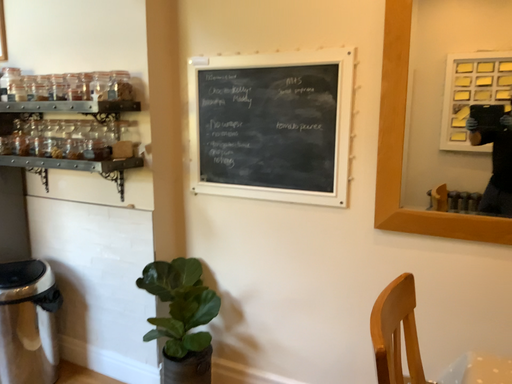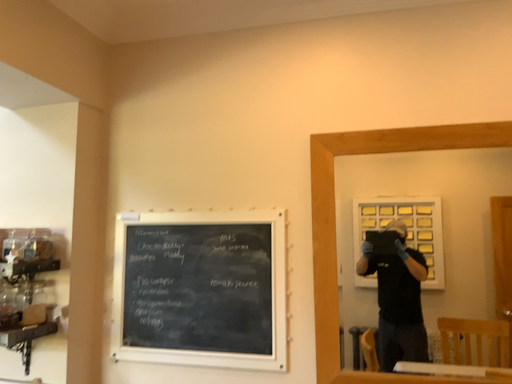
Question: Which way did the camera rotate in the video?

Choices:
 (A) rotated left
 (B) rotated right

Answer: (B)